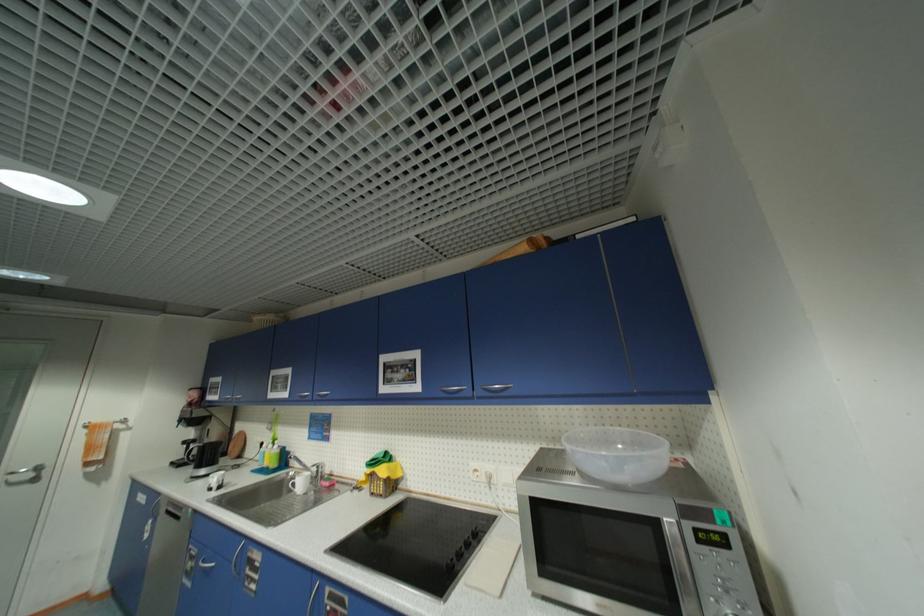
Locate an element on the screen. sink faucet handle is located at coordinates (310, 468).